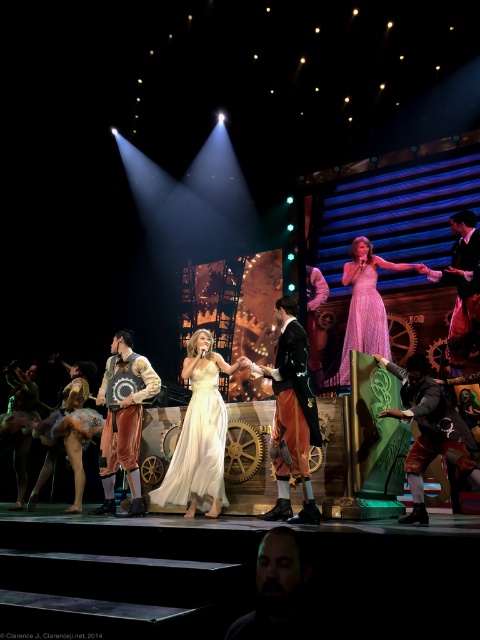
In the scene shown: You are a stagehand preparing to place a 3.5 meter long banner between the matte gold dress at lower left and the black leather jacket at right. Can the banner fit between them without overlapping either object?

The distance between the matte gold dress at lower left and the black leather jacket at right is 4.02 meters. Since the banner is 3.5 meters long, it can fit between them without overlapping as there is enough space.

You are a stagehand on the left side of the stage. You need to place a spotlight on the performer at point (288, 458) and another on the performer at point (189, 458). Which spotlight should you aim first to ensure the performer closer to the front gets lit first?

You should aim the spotlight on the performer at point (288, 458) first because it is in front of the performer at point (189, 458), so it is closer to the front and needs to be lit first.

You are a stagehand adjusting the lighting for the performance. The spotlight needs to be placed exactly 5 meters away from the camera to hit the center of the stage. Is the point at coordinates point (286, 449) within the required distance?

The point at coordinates point (286, 449) is 4.80 meters from the camera, which is slightly closer than the required 5 meters. Therefore, the spotlight placed at this point would be too close.